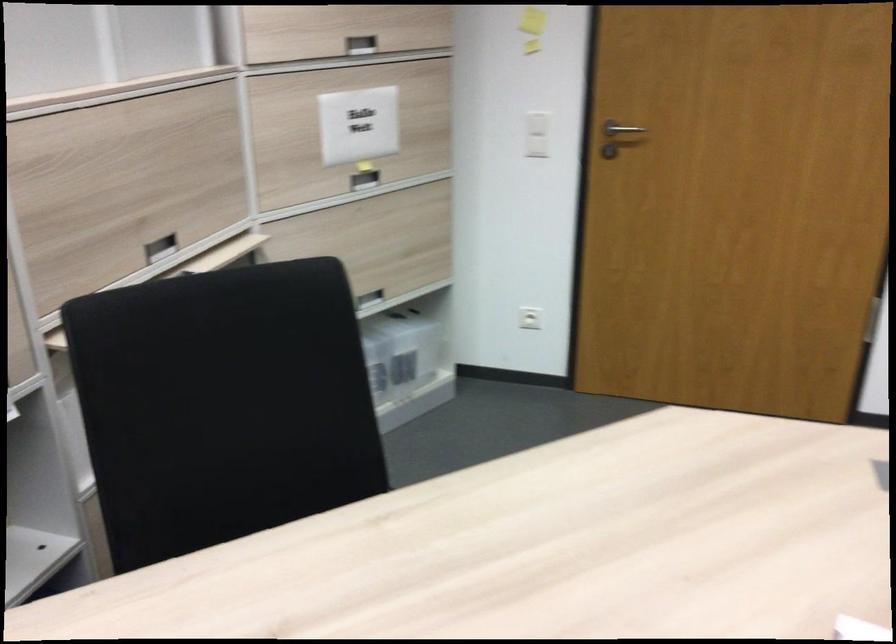
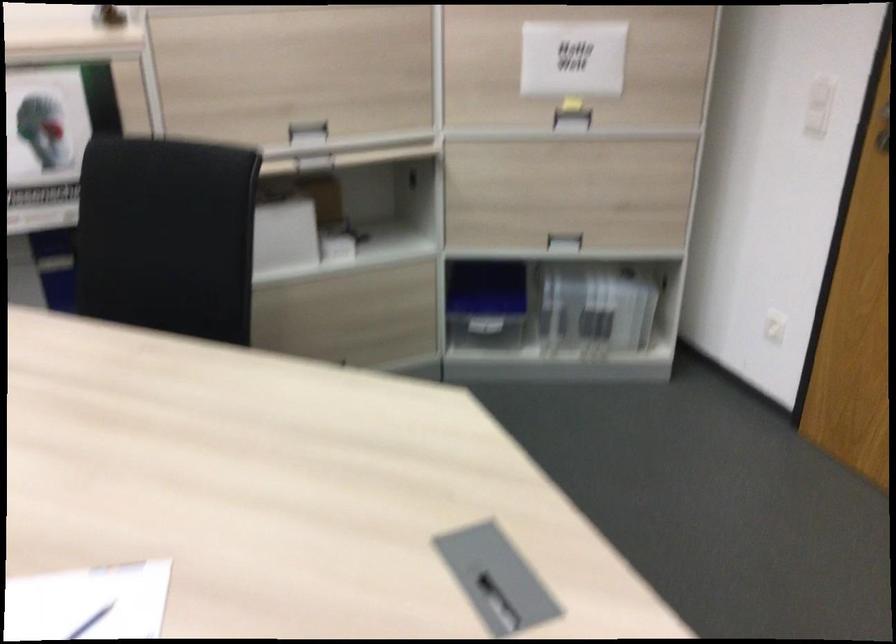
Locate, in the second image, the point that corresponds to the point at 158,243 in the first image.

(307, 129)